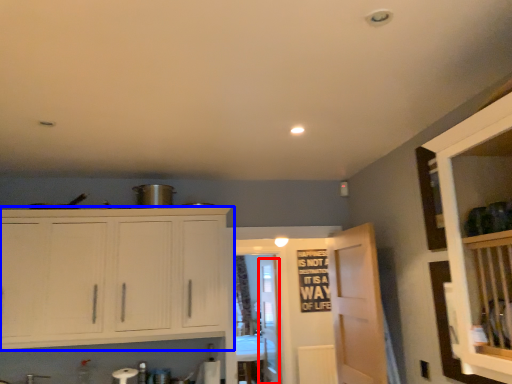
Question: Which of the following is the closest to the observer, glass door (highlighted by a red box) or cabinetry (highlighted by a blue box)?

Choices:
 (A) glass door
 (B) cabinetry

Answer: (B)